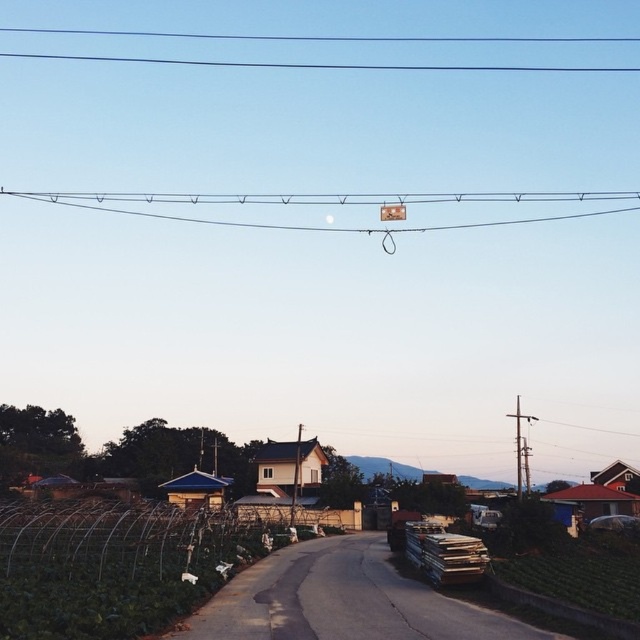
Question: Where is black wire at upper center located in relation to metallic rectangular sign at upper center in the image?

Choices:
 (A) below
 (B) above

Answer: (B)

Question: Is black wire at upper center wider than metallic silver car at right?

Choices:
 (A) yes
 (B) no

Answer: (A)

Question: Among these objects, which one is nearest to the camera?

Choices:
 (A) metallic silver car at right
 (B) metallic rectangular sign at upper center

Answer: (A)

Question: Which point is farther to the camera?

Choices:
 (A) metallic gray pole at right
 (B) metallic silver car at right
 (C) metallic rectangular sign at upper center

Answer: (C)

Question: Is black wire at upper center in front of metallic rectangular sign at upper center?

Choices:
 (A) no
 (B) yes

Answer: (A)

Question: Which object appears closest to the camera in this image?

Choices:
 (A) metallic silver car at right
 (B) metallic rectangular sign at upper center
 (C) black wire at upper center

Answer: (A)